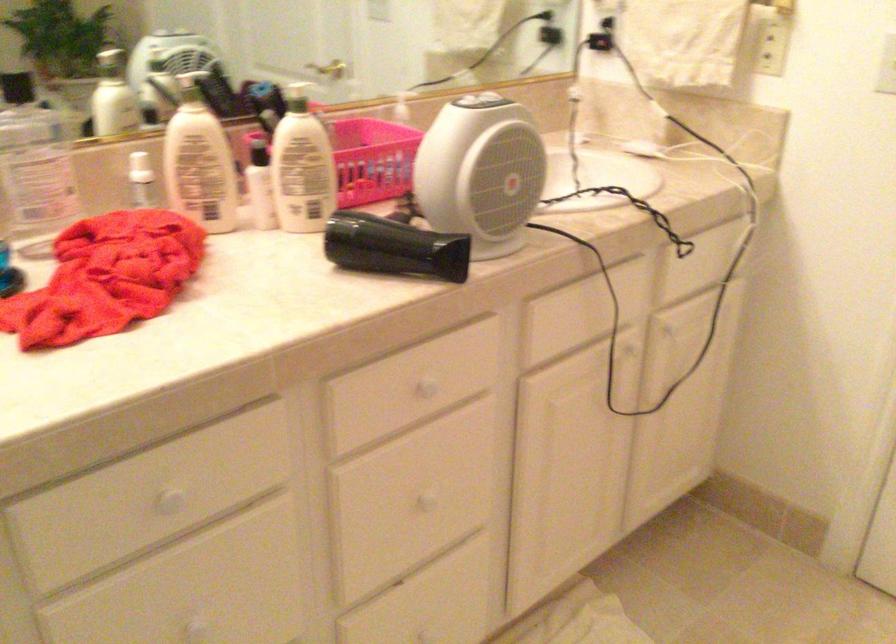
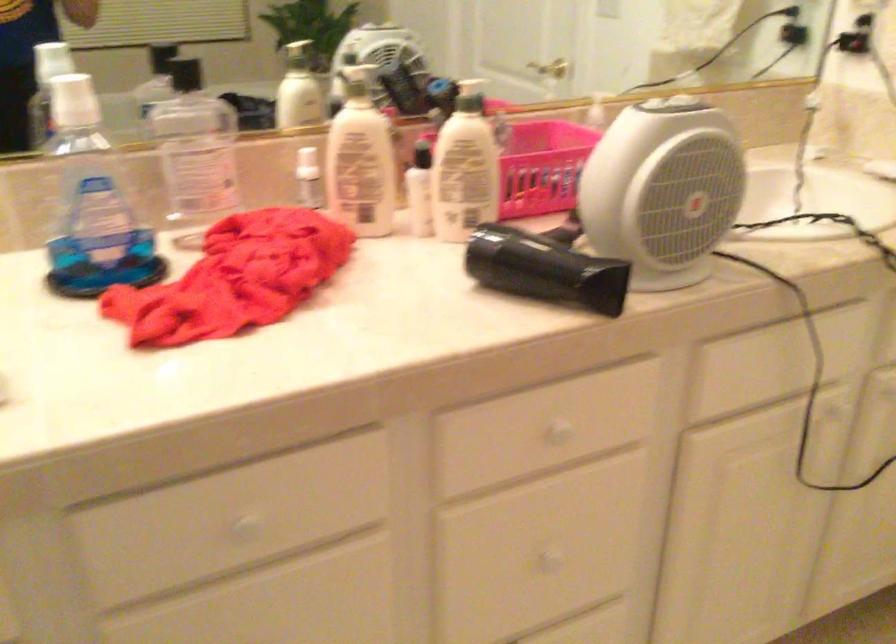
Question: Based on the continuous images, in which direction is the camera rotating? Reply with the corresponding letter.

Choices:
 (A) Left
 (B) Right
 (C) Up
 (D) Down

Answer: (A)